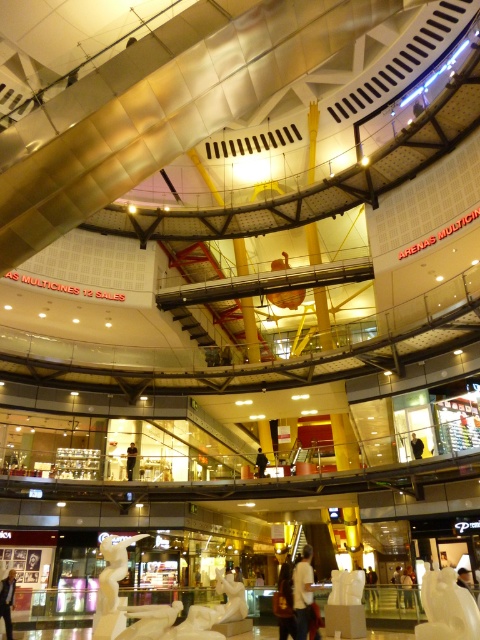
Can you confirm if white matte statue at center is shorter than black fabric person at center?

No.

Does white matte statue at center appear on the left side of black fabric person at center?

Yes, white matte statue at center is to the left of black fabric person at center.

This screenshot has height=640, width=480. Identify the location of white matte statue at center. (131, 460).

Who is more forward, (295,582) or (420,448)?

Point (295,582) is in front.

Is white fabric shirt at lower center taller than black fabric person at center?

Yes.

Identify the location of white fabric shirt at lower center. (302, 593).

Does dark blue jeans at lower left appear under black fabric person at center?

Indeed, dark blue jeans at lower left is positioned under black fabric person at center.

Between dark blue jeans at lower left and black fabric person at center, which one has less height?

With less height is black fabric person at center.

Identify the location of dark blue jeans at lower left. (8, 600).